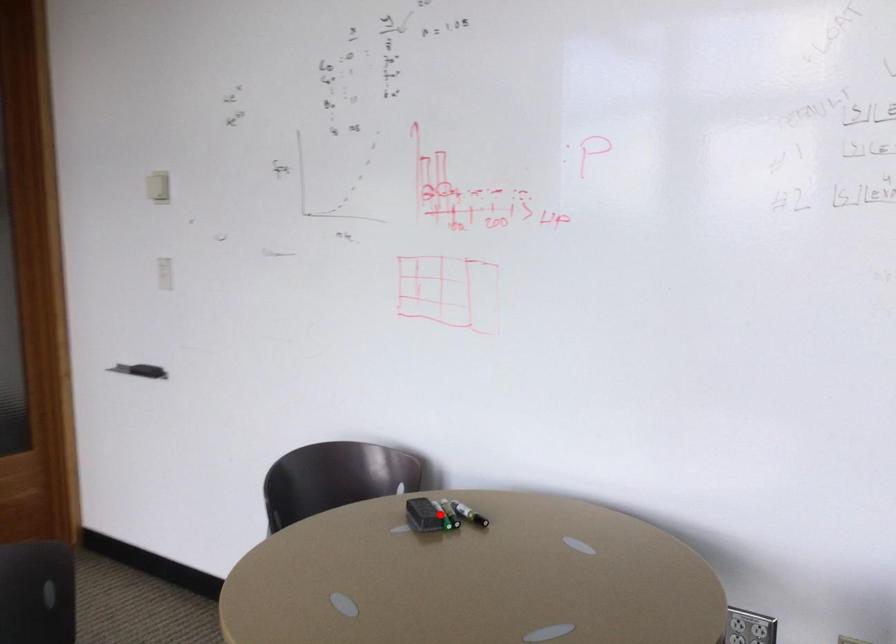
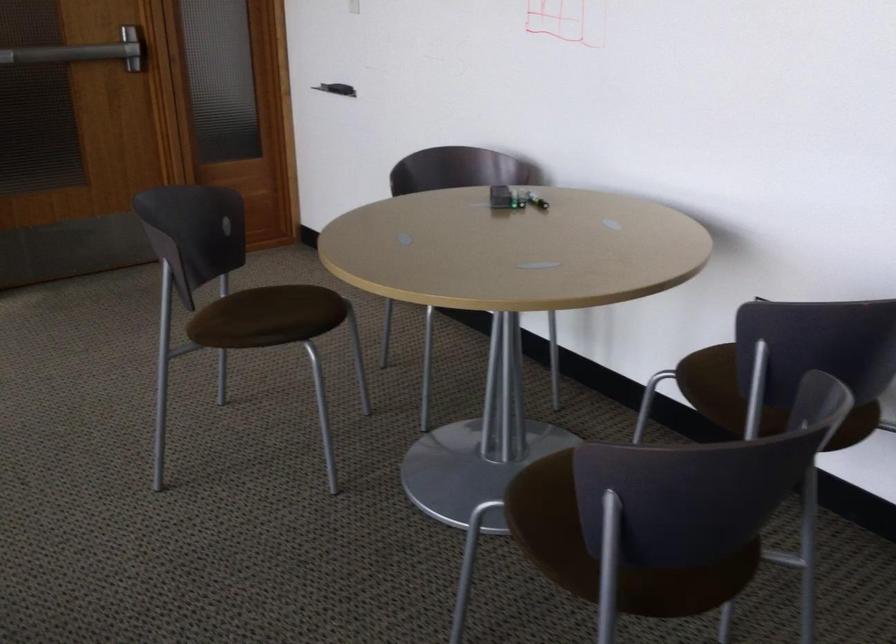
The point at the highlighted location is marked in the first image. Where is the corresponding point in the second image?

(515, 196)